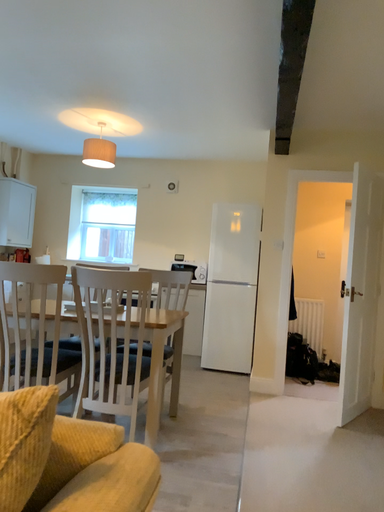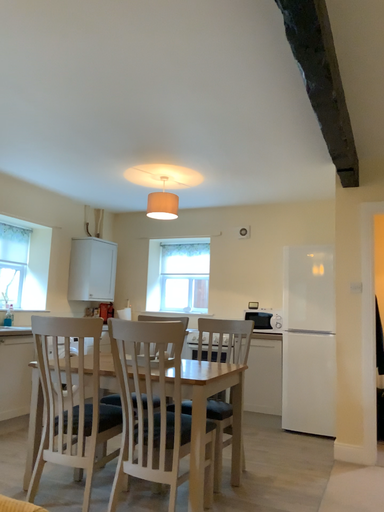
Question: Which way did the camera rotate in the video?

Choices:
 (A) rotated right
 (B) rotated left

Answer: (B)